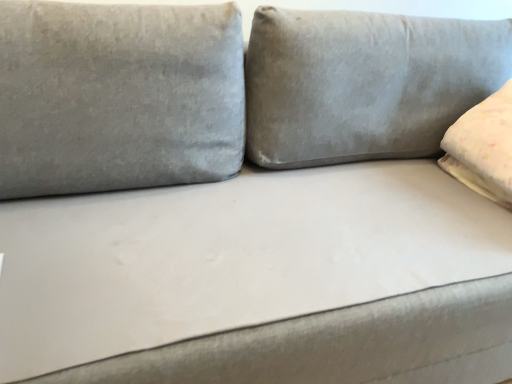
Describe the element at coordinates (483, 147) in the screenshot. This screenshot has width=512, height=384. I see `fluffy pastel pillow at right` at that location.

The height and width of the screenshot is (384, 512). In order to click on fluffy pastel pillow at right in this screenshot , I will do `click(483, 147)`.

Where is `fluffy pastel pillow at right`? This screenshot has height=384, width=512. fluffy pastel pillow at right is located at coordinates point(483,147).